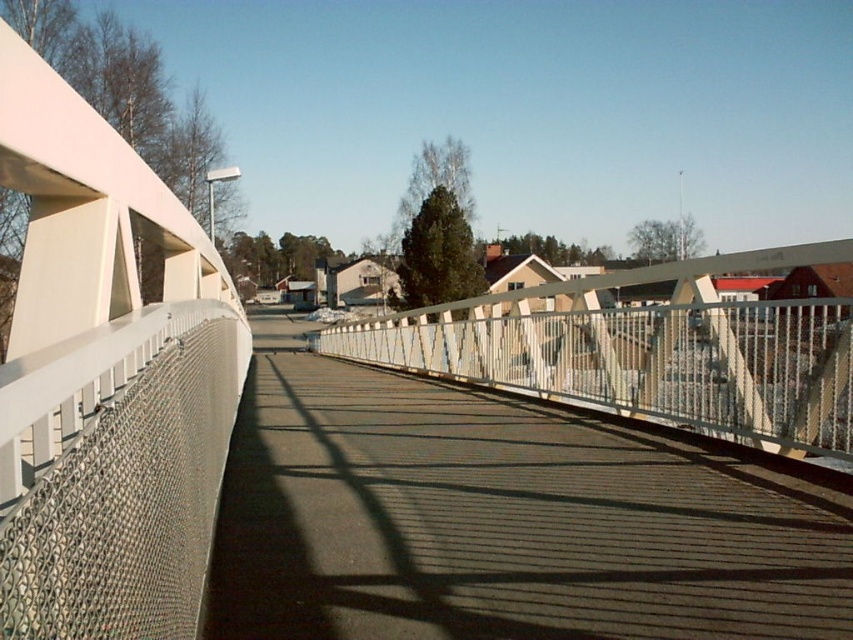
You are a maintenance worker needing to inspect two metallic mesh structures on a bridge. You see the metallic mesh at center and the metallic mesh railing at center. How far apart are these two structures?

The metallic mesh at center is 5.17 meters from the metallic mesh railing at center.

You are standing on the pedestrian bridge and want to walk from the metallic mesh railing at center to the metallic mesh at center. Which direction should you move to reach your destination?

You should move to the right to reach the metallic mesh at center from the metallic mesh railing at center because the metallic mesh at center is to the right of the metallic mesh railing at center.

You are standing on the pedestrian bridge and want to take a photo of both the metallic mesh at center and the metallic mesh railing at center. Which one will appear larger in your photo?

The metallic mesh at center will appear larger in your photo because it is closer to the viewer than the metallic mesh railing at center.